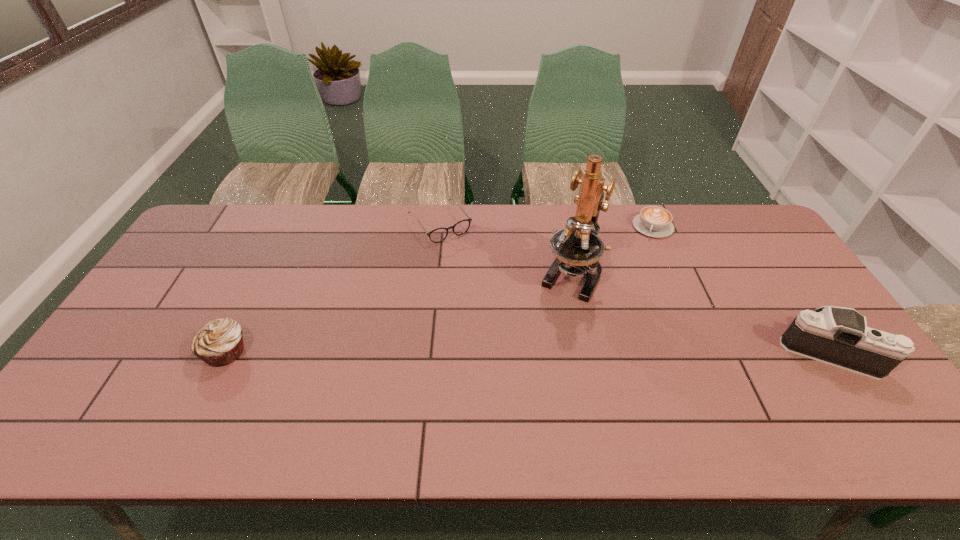
Identify the location of spectacles located at the far edge. The image size is (960, 540). (437, 235).

Where is `cappuccino that is at the far edge`? cappuccino that is at the far edge is located at coordinates (653, 221).

Locate an element on the screen. object present at the near edge is located at coordinates (838, 336).

Find the location of a particular element. This screenshot has width=960, height=540. object at the right edge is located at coordinates (838, 336).

This screenshot has width=960, height=540. In order to click on object at the near right corner in this screenshot , I will do `click(838, 336)`.

Where is `free space at the far edge of the desktop`? free space at the far edge of the desktop is located at coordinates (427, 242).

The image size is (960, 540). In the image, there is a desktop. Find the location of `free region at the near edge`. free region at the near edge is located at coordinates (338, 405).

Identify the location of free spot at the left edge of the desktop. This screenshot has height=540, width=960. (179, 272).

This screenshot has height=540, width=960. In order to click on vacant space at the right edge of the desktop in this screenshot , I will do `click(780, 292)`.

Locate an element on the screen. Image resolution: width=960 pixels, height=540 pixels. free space at the far left corner is located at coordinates (202, 239).